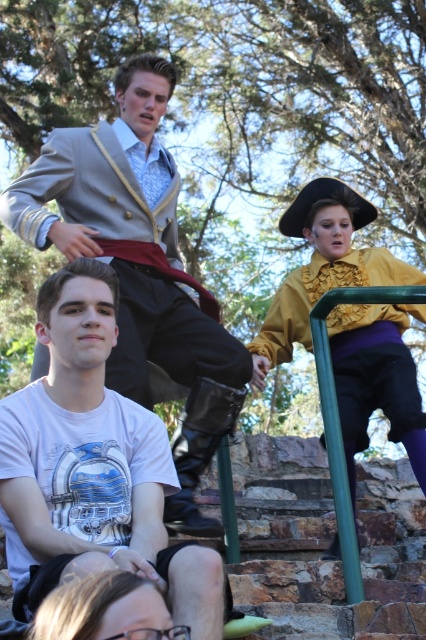
Question: Among these objects, which one is farthest from the camera?

Choices:
 (A) white cotton t-shirt at lower left
 (B) matte gray suit at upper left

Answer: (B)

Question: Considering the real-world distances, which object is farthest from the white cotton t-shirt at lower left?

Choices:
 (A) matte gray suit at upper left
 (B) matte yellow blouse at upper right

Answer: (B)

Question: Where is white cotton t-shirt at lower left located in relation to matte gray suit at upper left in the image?

Choices:
 (A) left
 (B) right

Answer: (B)

Question: Which of these objects is positioned farthest from the matte yellow blouse at upper right?

Choices:
 (A) matte gray suit at upper left
 (B) white cotton t-shirt at lower left

Answer: (B)

Question: Does white cotton t-shirt at lower left have a smaller size compared to matte gray suit at upper left?

Choices:
 (A) no
 (B) yes

Answer: (B)

Question: Can you confirm if matte gray suit at upper left is positioned above matte yellow blouse at upper right?

Choices:
 (A) yes
 (B) no

Answer: (A)